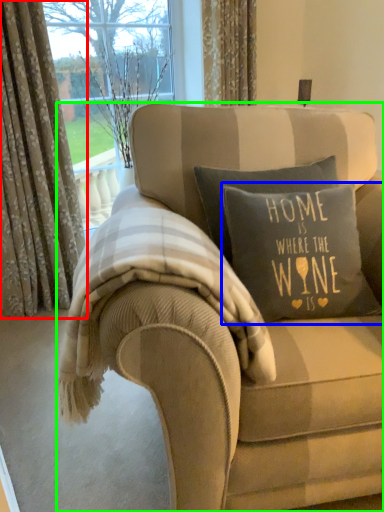
Question: Considering the real-world distances, which object is farthest from curtain (highlighted by a red box)? pillow (highlighted by a blue box) or studio couch (highlighted by a green box)?

Choices:
 (A) pillow
 (B) studio couch

Answer: (B)